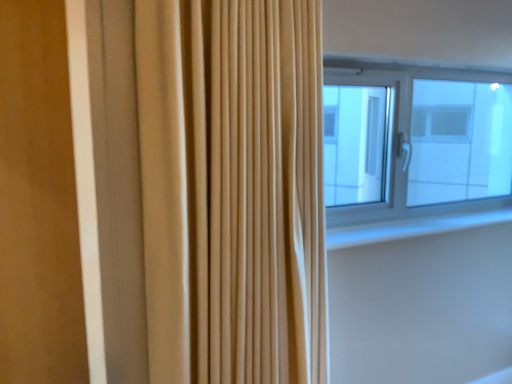
Question: Is white smooth window sill at upper right to the right of beige fabric curtain at center from the viewer's perspective?

Choices:
 (A) yes
 (B) no

Answer: (A)

Question: Considering the relative sizes of white smooth window sill at upper right and beige fabric curtain at center in the image provided, is white smooth window sill at upper right shorter than beige fabric curtain at center?

Choices:
 (A) no
 (B) yes

Answer: (B)

Question: Considering the relative sizes of white smooth window sill at upper right and beige fabric curtain at center in the image provided, is white smooth window sill at upper right bigger than beige fabric curtain at center?

Choices:
 (A) no
 (B) yes

Answer: (A)

Question: Is white smooth window sill at upper right wider than beige fabric curtain at center?

Choices:
 (A) no
 (B) yes

Answer: (A)

Question: Can beige fabric curtain at center be found inside white smooth window sill at upper right?

Choices:
 (A) yes
 (B) no

Answer: (B)

Question: Is beige fabric curtain at center in front of or behind white smooth window sill at upper right in the image?

Choices:
 (A) front
 (B) behind

Answer: (A)

Question: In terms of width, does beige fabric curtain at center look wider or thinner when compared to white smooth window sill at upper right?

Choices:
 (A) wide
 (B) thin

Answer: (A)

Question: Considering the positions of beige fabric curtain at center and white smooth window sill at upper right in the image, is beige fabric curtain at center taller or shorter than white smooth window sill at upper right?

Choices:
 (A) short
 (B) tall

Answer: (B)

Question: From a real-world perspective, is beige fabric curtain at center physically located above or below white smooth window sill at upper right?

Choices:
 (A) above
 (B) below

Answer: (A)

Question: Based on their sizes in the image, would you say beige fabric curtain at center is bigger or smaller than transparent glass window at upper right?

Choices:
 (A) small
 (B) big

Answer: (B)

Question: From a real-world perspective, is beige fabric curtain at center above or below transparent glass window at upper right?

Choices:
 (A) above
 (B) below

Answer: (B)

Question: From the image's perspective, is beige fabric curtain at center positioned above or below transparent glass window at upper right?

Choices:
 (A) above
 (B) below

Answer: (B)

Question: In the image, is beige fabric curtain at center on the left side or the right side of transparent glass window at upper right?

Choices:
 (A) left
 (B) right

Answer: (A)

Question: Considering their positions, is transparent glass window at upper right located in front of or behind beige fabric curtain at center?

Choices:
 (A) front
 (B) behind

Answer: (B)

Question: Is transparent glass window at upper right bigger or smaller than beige fabric curtain at center?

Choices:
 (A) big
 (B) small

Answer: (B)